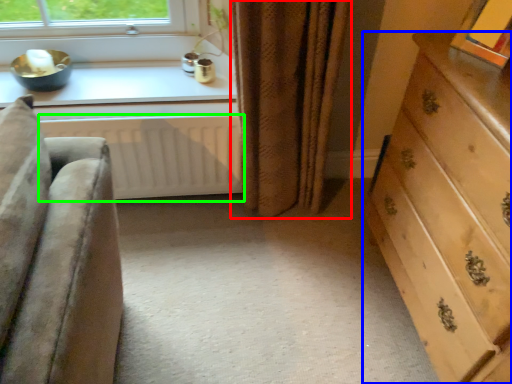
Question: Considering the real-world distances, which object is farthest from curtain (highlighted by a red box)? chest of drawers (highlighted by a blue box) or radiator (highlighted by a green box)?

Choices:
 (A) chest of drawers
 (B) radiator

Answer: (A)